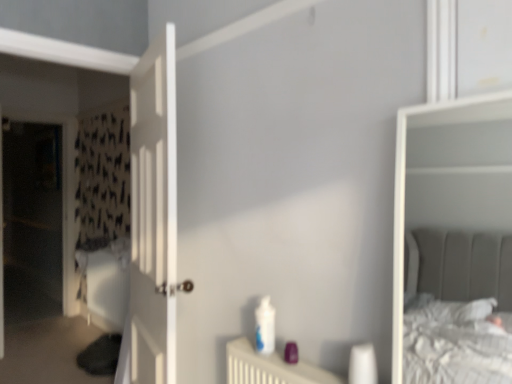
Locate an element on the screen. The height and width of the screenshot is (384, 512). white wooden door at left is located at coordinates (153, 220).

Where is `white wooden door at left`? white wooden door at left is located at coordinates (153, 220).

Is transparent plastic screen door at left inside white wooden door at left?

No, transparent plastic screen door at left is not surrounded by white wooden door at left.

Considering the positions of objects white wooden door at left and transparent plastic screen door at left in the image provided, who is more to the right, white wooden door at left or transparent plastic screen door at left?

white wooden door at left.

From a real-world perspective, is white wooden door at left physically located above or below transparent plastic screen door at left?

From a real-world perspective, white wooden door at left is physically above transparent plastic screen door at left.

Does point (173, 364) appear closer or farther from the camera than point (25, 226)?

Point (173, 364) is closer to the camera than point (25, 226).

Based on the photo, is white wooden door at left completely or partially outside of white glossy bottle at center?

Yes, white wooden door at left is outside of white glossy bottle at center.

Can you tell me how much white wooden door at left and white glossy bottle at center differ in facing direction?

The facing directions of white wooden door at left and white glossy bottle at center are 15.8 degrees apart.

From a real-world perspective, which object rests below the other?

white glossy bottle at center is physically lower.

Is white glossy bottle at center at the back of white wooden door at left?

No, white glossy bottle at center is not at the back of white wooden door at left.

Is transparent plastic screen door at left thinner than white wooden door at left?

Correct, the width of transparent plastic screen door at left is less than that of white wooden door at left.

Could you tell me if transparent plastic screen door at left is facing white wooden door at left?

Yes, transparent plastic screen door at left is facing white wooden door at left.

Is point (34, 251) closer or farther from the camera than point (158, 123)?

Clearly, point (34, 251) is more distant from the camera than point (158, 123).

Between transparent plastic screen door at left and white wooden door at left, which one has more height?

Standing taller between the two is transparent plastic screen door at left.

Is point (38, 315) closer or farther from the camera than point (262, 303)?

Clearly, point (38, 315) is more distant from the camera than point (262, 303).

From a real-world perspective, is transparent plastic screen door at left under white glossy bottle at center?

Actually, transparent plastic screen door at left is physically above white glossy bottle at center in the real world.

From the picture: Is transparent plastic screen door at left looking in the opposite direction of white glossy bottle at center?

No, transparent plastic screen door at left is not facing away from white glossy bottle at center.

Does transparent plastic screen door at left have a larger size compared to white glossy bottle at center?

Yes, transparent plastic screen door at left is bigger than white glossy bottle at center.

Is white glossy bottle at center looking in the opposite direction of transparent plastic screen door at left?

No.

In the image, is white glossy bottle at center on the left side or the right side of transparent plastic screen door at left?

white glossy bottle at center is positioned on transparent plastic screen door at left's right side.

In the scene shown: Does white glossy bottle at center have a lesser width compared to transparent plastic screen door at left?

Indeed, white glossy bottle at center has a lesser width compared to transparent plastic screen door at left.

Which object is more forward, white glossy bottle at center or transparent plastic screen door at left?

white glossy bottle at center.

Can you confirm if white glossy bottle at center is positioned to the right of white wooden door at left?

Yes.

From the image's perspective, is white glossy bottle at center located above or below white wooden door at left?

white glossy bottle at center is situated lower than white wooden door at left in the image.

Is white glossy bottle at center further to the viewer compared to white wooden door at left?

No, the depth of white glossy bottle at center is less than that of white wooden door at left.

What's the angular difference between white glossy bottle at center and white wooden door at left's facing directions?

The angular difference between white glossy bottle at center and white wooden door at left is 15.8 degrees.

Locate an element on the screen. door lying on the right of transparent plastic screen door at left is located at coordinates (153, 220).

Locate an element on the screen. door positioned vertically above the white glossy bottle at center (from a real-world perspective) is located at coordinates (153, 220).

Estimate the real-world distances between objects in this image. Which object is further from white glossy bottle at center, transparent plastic screen door at left or white wooden door at left?

transparent plastic screen door at left.

Based on the photo, estimate the real-world distances between objects in this image. Which object is closer to white wooden door at left, transparent plastic screen door at left or white glossy bottle at center?

The object closer to white wooden door at left is white glossy bottle at center.

When comparing their distances from transparent plastic screen door at left, does white glossy bottle at center or white wooden door at left seem further?

Among the two, white glossy bottle at center is located further to transparent plastic screen door at left.

Looking at the image, which one is located closer to white glossy bottle at center, white wooden door at left or transparent plastic screen door at left?

Based on the image, white wooden door at left appears to be nearer to white glossy bottle at center.

When comparing their distances from transparent plastic screen door at left, does white wooden door at left or white glossy bottle at center seem further?

white glossy bottle at center.

Looking at the image, which one is located closer to white wooden door at left, white glossy bottle at center or transparent plastic screen door at left?

Based on the image, white glossy bottle at center appears to be nearer to white wooden door at left.

Image resolution: width=512 pixels, height=384 pixels. In order to click on door located between white glossy bottle at center and transparent plastic screen door at left in the depth direction in this screenshot , I will do `click(153, 220)`.